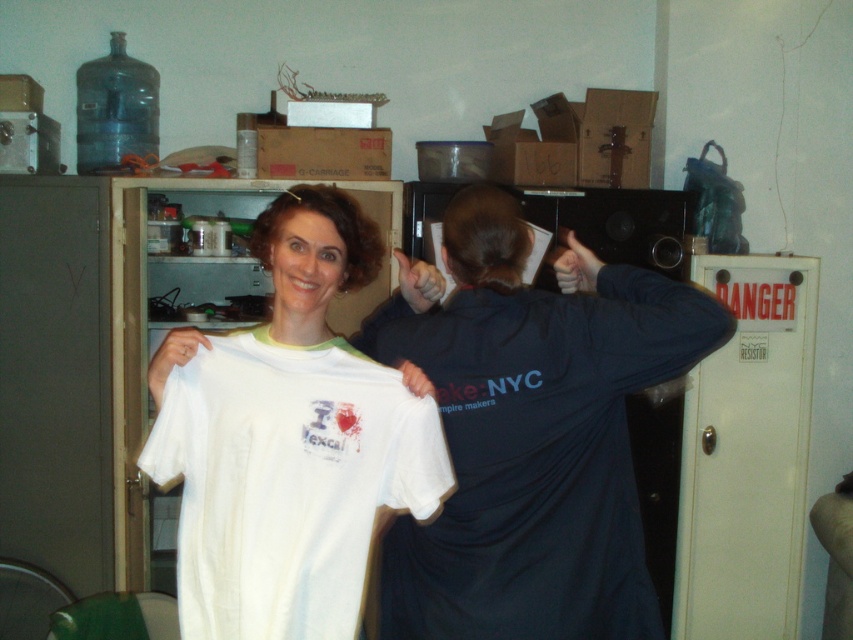
Does point (608, 472) lie behind point (408, 474)?

Yes, it is.

Does white matte t-shirt at center have a greater width compared to white cotton t-shirt at center?

Yes, white matte t-shirt at center is wider than white cotton t-shirt at center.

What do you see at coordinates (531, 436) in the screenshot?
I see `white matte t-shirt at center` at bounding box center [531, 436].

At what (x,y) coordinates should I click in order to perform the action: click on white matte t-shirt at center. Please return your answer as a coordinate pair (x, y). Image resolution: width=853 pixels, height=640 pixels. Looking at the image, I should click on (531, 436).